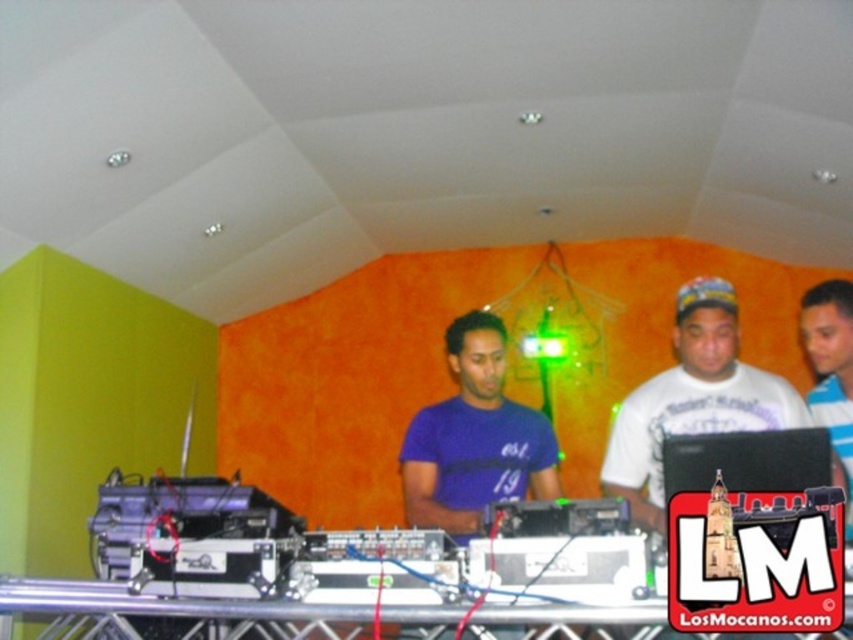
Question: Which point appears farthest from the camera in this image?

Choices:
 (A) (813, 320)
 (B) (672, 369)

Answer: (B)

Question: Can you confirm if white cotton shirt at center is positioned to the right of black plastic laptop at center?

Choices:
 (A) no
 (B) yes

Answer: (A)

Question: Which object appears closest to the camera in this image?

Choices:
 (A) black plastic laptop at center
 (B) white cotton shirt at center
 (C) white striped shirt at center

Answer: (A)

Question: Which point appears closest to the camera in this image?

Choices:
 (A) 634,488
 (B) 735,436
 (C) 851,330

Answer: (B)

Question: Does white cotton shirt at center have a greater width compared to black plastic laptop at center?

Choices:
 (A) no
 (B) yes

Answer: (B)

Question: Does white cotton shirt at center have a smaller size compared to black plastic laptop at center?

Choices:
 (A) yes
 (B) no

Answer: (B)